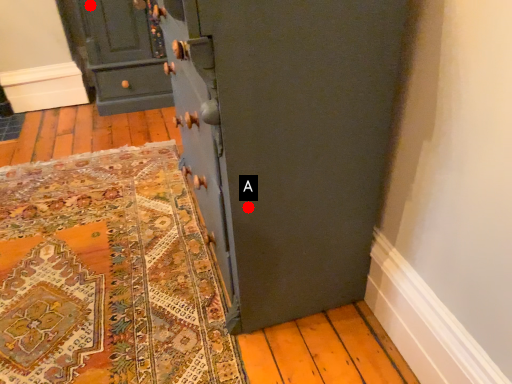
Question: Two points are circled on the image, labeled by A and B beside each circle. Which point appears farthest from the camera in this image?

Choices:
 (A) A is further
 (B) B is further

Answer: (B)